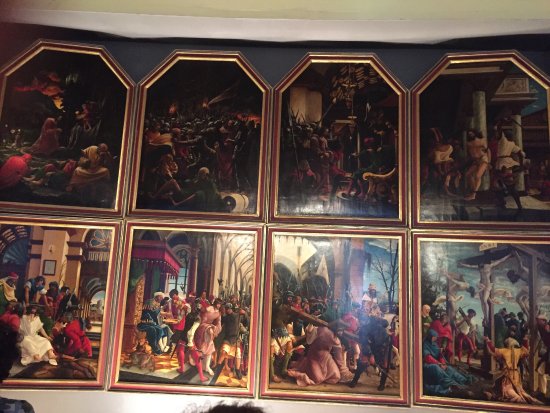
Where is `picture`? picture is located at coordinates (249, 205).